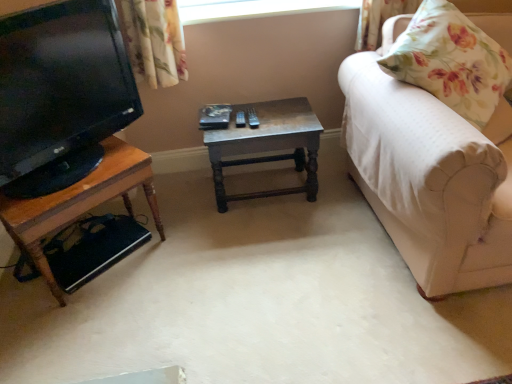
Question: From the image's perspective, is white fabric couch at right located above or below floral fabric pillow at right?

Choices:
 (A) below
 (B) above

Answer: (A)

Question: Based on their positions, is white fabric couch at right located to the left or right of floral fabric pillow at right?

Choices:
 (A) left
 (B) right

Answer: (B)

Question: Which object is positioned farthest from the woodenobject at left, the 1th table positioned from the left?

Choices:
 (A) white fabric couch at right
 (B) transparent glass window at upper center
 (C) matte black tv at left
 (D) floral fabric pillow at right
 (E) wooden table at center, acting as the first table starting from the right

Answer: (D)

Question: Estimate the real-world distances between objects in this image. Which object is closer to the transparent glass window at upper center?

Choices:
 (A) wooden table at center, positioned as the second table in left-to-right order
 (B) white fabric couch at right
 (C) floral fabric pillow at right
 (D) matte black tv at left
 (E) woodenobject at left, arranged as the second table when viewed from the right

Answer: (A)